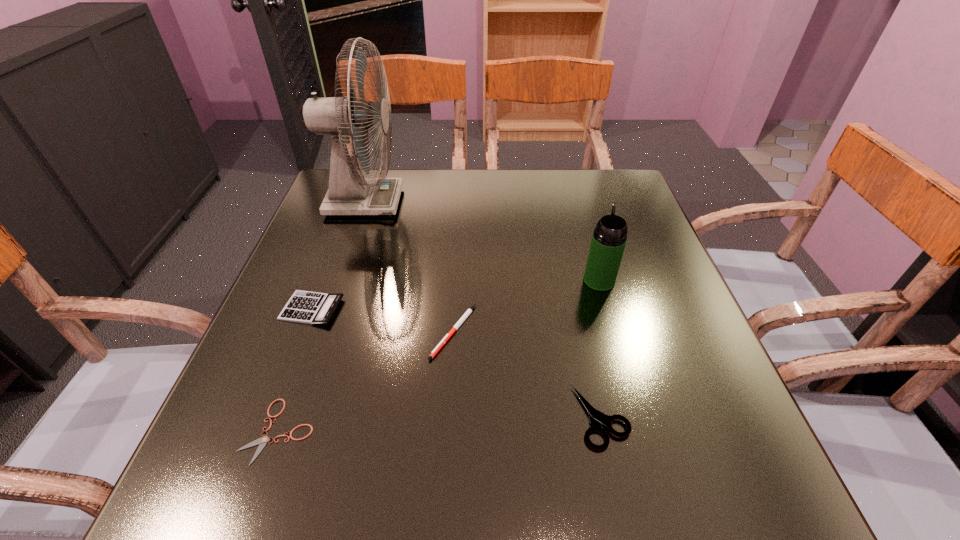
Locate an element on the screen. This screenshot has width=960, height=540. vacant space located 0.160m from the spout of the fifth shortest object is located at coordinates (584, 226).

Where is `vacant point located from the spout of the fifth shortest object`? The width and height of the screenshot is (960, 540). vacant point located from the spout of the fifth shortest object is located at coordinates (586, 234).

Where is `vacant position located on the right of the third tallest object`? The image size is (960, 540). vacant position located on the right of the third tallest object is located at coordinates (512, 308).

Find the location of a particular element. This screenshot has width=960, height=540. vacant space located 0.070m on the clicker of the third object from right to left is located at coordinates (450, 396).

Where is `vacant region located 0.050m on the back of the taller shears`? vacant region located 0.050m on the back of the taller shears is located at coordinates (589, 362).

Where is `vacant space located 0.310m on the right of the shorter shears`? vacant space located 0.310m on the right of the shorter shears is located at coordinates (510, 431).

Where is `object situated at the far edge`? The height and width of the screenshot is (540, 960). object situated at the far edge is located at coordinates (343, 117).

Where is `fan that is at the left edge`? The width and height of the screenshot is (960, 540). fan that is at the left edge is located at coordinates tap(343, 117).

This screenshot has width=960, height=540. Find the location of `calculator that is at the left edge`. calculator that is at the left edge is located at coordinates (307, 307).

Find the location of `shears that is at the left edge`. shears that is at the left edge is located at coordinates (262, 441).